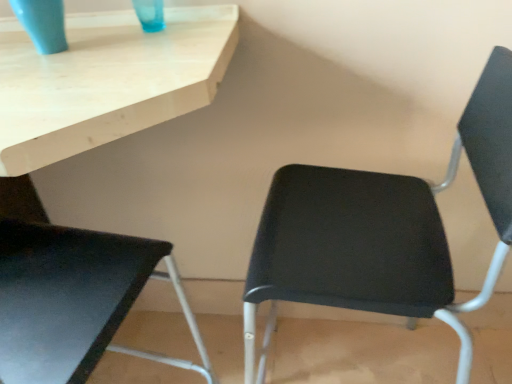
How much space does black plastic chair at center, positioned as the 2th chair in left-to-right order, occupy horizontally?

The width of black plastic chair at center, positioned as the 2th chair in left-to-right order, is 16.97 inches.

Locate an element on the screen. matte blue glass at upper left is located at coordinates (42, 23).

Is matte blue glass at upper left at the right side of black plastic chair at center, positioned as the 2th chair in left-to-right order?

In fact, matte blue glass at upper left is to the left of black plastic chair at center, positioned as the 2th chair in left-to-right order.

This screenshot has height=384, width=512. In order to click on glass vase that is on the left side of black plastic chair at center, positioned as the 2th chair in left-to-right order in this screenshot , I will do `click(42, 23)`.

In the image, is matte blue glass at upper left positioned in front of or behind black plastic chair at center, positioned as the 2th chair in left-to-right order?

matte blue glass at upper left is behind black plastic chair at center, positioned as the 2th chair in left-to-right order.

From the picture: From their relative heights in the image, would you say matte black chair at lower left, which is counted as the first chair, starting from the left, is taller or shorter than matte blue glass at upper left?

matte black chair at lower left, which is counted as the first chair, starting from the left, is taller than matte blue glass at upper left.

Can you confirm if matte black chair at lower left, which is counted as the first chair, starting from the left, is wider than matte blue glass at upper left?

Yes, matte black chair at lower left, which is counted as the first chair, starting from the left, is wider than matte blue glass at upper left.

Does point (126, 288) come behind point (33, 27)?

No, (126, 288) is closer to viewer.

Measure the distance from matte black chair at lower left, which appears as the 2th chair when viewed from the right, to matte blue glass at upper left.

A distance of 15.33 inches exists between matte black chair at lower left, which appears as the 2th chair when viewed from the right, and matte blue glass at upper left.

From a real-world perspective, which is physically below, black plastic chair at center, positioned as the 2th chair in left-to-right order, or matte blue glass at upper left?

In real-world perspective, black plastic chair at center, positioned as the 2th chair in left-to-right order, is lower.

Is black plastic chair at center, which is the first chair from right to left, surrounding matte blue glass at upper left?

That's incorrect, matte blue glass at upper left is not inside black plastic chair at center, which is the first chair from right to left.

Between black plastic chair at center, which is the first chair from right to left, and matte blue glass at upper left, which one has less height?

matte blue glass at upper left.

Is there a large distance between black plastic chair at center, which is the first chair from right to left, and matte blue glass at upper left?

That's not correct — black plastic chair at center, which is the first chair from right to left, is a little close to matte blue glass at upper left.

Between matte blue glass at upper left and matte black chair at lower left, which is counted as the first chair, starting from the left, which one has larger size?

matte black chair at lower left, which is counted as the first chair, starting from the left.

Which object is positioned more to the left, matte blue glass at upper left or matte black chair at lower left, which is counted as the first chair, starting from the left?

From the viewer's perspective, matte black chair at lower left, which is counted as the first chair, starting from the left, appears more on the left side.

Is point (56, 4) positioned after point (97, 341)?

Yes, point (56, 4) is behind point (97, 341).

In the image, is black plastic chair at center, which is the first chair from right to left, on the left side or the right side of matte black chair at lower left, which is counted as the first chair, starting from the left?

From the image, it's evident that black plastic chair at center, which is the first chair from right to left, is to the right of matte black chair at lower left, which is counted as the first chair, starting from the left.

Is black plastic chair at center, positioned as the 2th chair in left-to-right order, bigger or smaller than matte black chair at lower left, which appears as the 2th chair when viewed from the right?

In the image, black plastic chair at center, positioned as the 2th chair in left-to-right order, appears to be smaller than matte black chair at lower left, which appears as the 2th chair when viewed from the right.

Does point (351, 242) lie behind point (132, 291)?

That is True.

Does matte black chair at lower left, which appears as the 2th chair when viewed from the right, have a lesser width compared to black plastic chair at center, which is the first chair from right to left?

Indeed, matte black chair at lower left, which appears as the 2th chair when viewed from the right, has a lesser width compared to black plastic chair at center, which is the first chair from right to left.

Considering the relative sizes of matte black chair at lower left, which appears as the 2th chair when viewed from the right, and black plastic chair at center, which is the first chair from right to left, in the image provided, is matte black chair at lower left, which appears as the 2th chair when viewed from the right, taller than black plastic chair at center, which is the first chair from right to left,?

In fact, matte black chair at lower left, which appears as the 2th chair when viewed from the right, may be shorter than black plastic chair at center, which is the first chair from right to left.

Does matte black chair at lower left, which appears as the 2th chair when viewed from the right, turn towards black plastic chair at center, positioned as the 2th chair in left-to-right order?

No, matte black chair at lower left, which appears as the 2th chair when viewed from the right, is not turned towards black plastic chair at center, positioned as the 2th chair in left-to-right order.

Locate an element on the screen. glass vase above the black plastic chair at center, positioned as the 2th chair in left-to-right order (from a real-world perspective) is located at coordinates point(42,23).

The width and height of the screenshot is (512, 384). In order to click on glass vase behind the matte black chair at lower left, which is counted as the first chair, starting from the left in this screenshot , I will do click(x=42, y=23).

Considering their positions, is matte black chair at lower left, which is counted as the first chair, starting from the left, positioned closer to black plastic chair at center, which is the first chair from right to left, than matte blue glass at upper left?

matte black chair at lower left, which is counted as the first chair, starting from the left, is positioned closer to the anchor black plastic chair at center, which is the first chair from right to left.

Estimate the real-world distances between objects in this image. Which object is further from matte blue glass at upper left, black plastic chair at center, positioned as the 2th chair in left-to-right order, or matte black chair at lower left, which is counted as the first chair, starting from the left?

black plastic chair at center, positioned as the 2th chair in left-to-right order, is further to matte blue glass at upper left.

When comparing their distances from black plastic chair at center, which is the first chair from right to left, does matte blue glass at upper left or matte black chair at lower left, which is counted as the first chair, starting from the left, seem closer?

matte black chair at lower left, which is counted as the first chair, starting from the left, is positioned closer to the anchor black plastic chair at center, which is the first chair from right to left.

When comparing their distances from matte black chair at lower left, which is counted as the first chair, starting from the left, does black plastic chair at center, which is the first chair from right to left, or matte blue glass at upper left seem closer?

matte blue glass at upper left lies closer to matte black chair at lower left, which is counted as the first chair, starting from the left, than the other object.

When comparing their distances from matte blue glass at upper left, does matte black chair at lower left, which is counted as the first chair, starting from the left, or black plastic chair at center, positioned as the 2th chair in left-to-right order, seem further?

Among the two, black plastic chair at center, positioned as the 2th chair in left-to-right order, is located further to matte blue glass at upper left.

Based on the photo, considering their positions, is matte blue glass at upper left positioned further to matte black chair at lower left, which is counted as the first chair, starting from the left, than black plastic chair at center, positioned as the 2th chair in left-to-right order?

black plastic chair at center, positioned as the 2th chair in left-to-right order, is positioned further to the anchor matte black chair at lower left, which is counted as the first chair, starting from the left.

The width and height of the screenshot is (512, 384). I want to click on glass vase between matte black chair at lower left, which is counted as the first chair, starting from the left, and black plastic chair at center, positioned as the 2th chair in left-to-right order, in the horizontal direction, so click(42, 23).